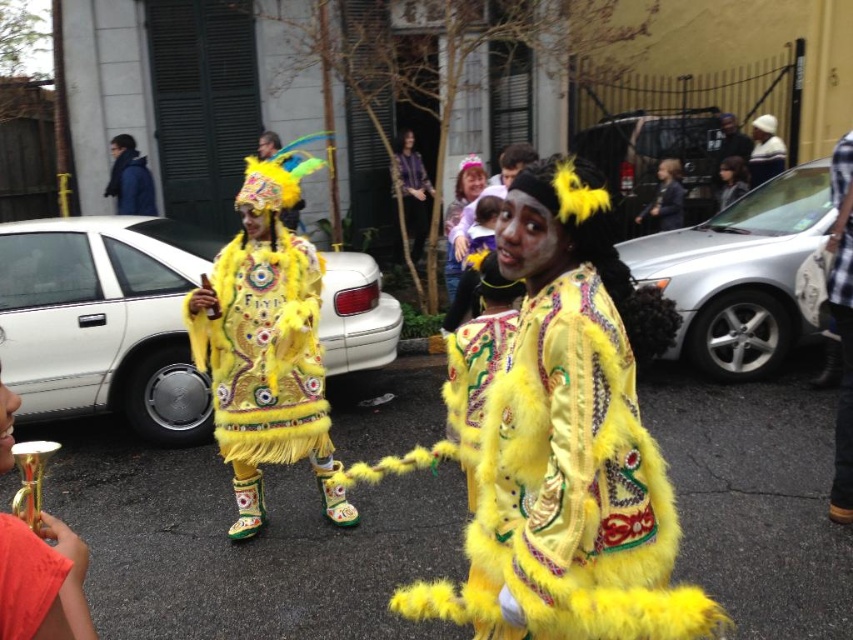
Question: Which object is positioned closest to the fuzzy yellow coat at center?

Choices:
 (A) matte yellow costume at center
 (B) blue fuzzy jacket at upper left

Answer: (B)

Question: Does yellow satin costume at center have a greater width compared to shiny purple jacket at center?

Choices:
 (A) yes
 (B) no

Answer: (A)

Question: Can you confirm if fuzzy yellow coat at center is positioned above blue fuzzy jacket at upper left?

Choices:
 (A) no
 (B) yes

Answer: (A)

Question: Does fuzzy yellow coat at center come behind shiny purple jacket at center?

Choices:
 (A) yes
 (B) no

Answer: (B)

Question: Based on their relative distances, which object is nearer to the matte black jacket at center?

Choices:
 (A) blue fuzzy jacket at upper left
 (B) plaid shirt at right
 (C) yellow satin costume at center

Answer: (B)

Question: Which of the following is the farthest from the observer?

Choices:
 (A) blue fuzzy jacket at upper left
 (B) yellow satin costume at center

Answer: (A)